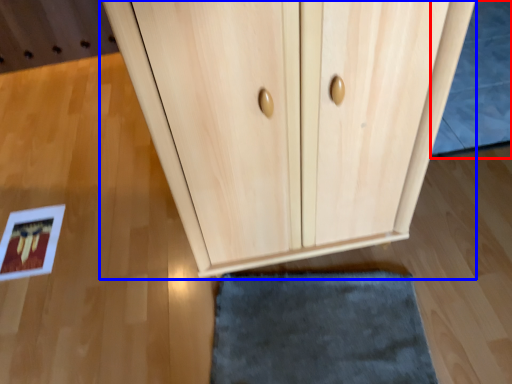
Question: Which object is further to the camera taking this photo, bath mat (highlighted by a red box) or cupboard (highlighted by a blue box)?

Choices:
 (A) bath mat
 (B) cupboard

Answer: (A)